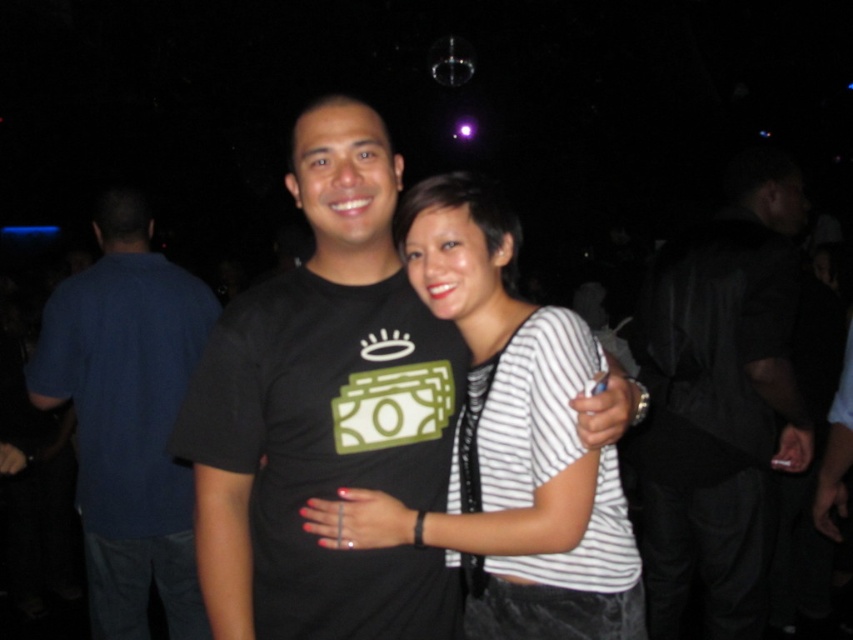
Question: Among these objects, which one is nearest to the camera?

Choices:
 (A) dark blue shirt at left
 (B) black leather jacket at right

Answer: (A)

Question: Is black leather jacket at right smaller than white striped shirt at center?

Choices:
 (A) yes
 (B) no

Answer: (B)

Question: Which point is closer to the camera?

Choices:
 (A) black leather jacket at right
 (B) dark blue shirt at left
 (C) white striped shirt at center

Answer: (C)

Question: Does black leather jacket at right have a smaller size compared to dark blue shirt at left?

Choices:
 (A) no
 (B) yes

Answer: (A)

Question: Which object is closer to the camera taking this photo?

Choices:
 (A) dark blue shirt at left
 (B) white striped shirt at center
 (C) black leather jacket at right

Answer: (B)

Question: Is black leather jacket at right behind dark blue shirt at left?

Choices:
 (A) no
 (B) yes

Answer: (B)